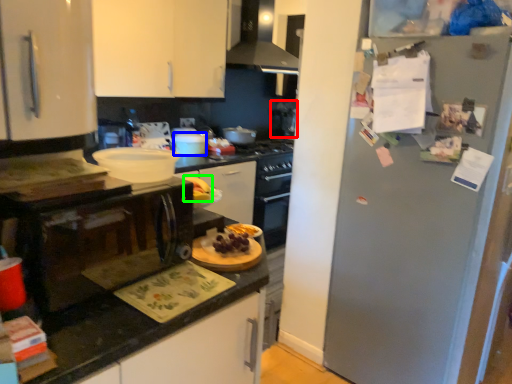
Question: Which object is the closest to the appliance (highlighted by a red box)? Choose among these: appliance (highlighted by a blue box) or food (highlighted by a green box).

Choices:
 (A) appliance
 (B) food

Answer: (A)